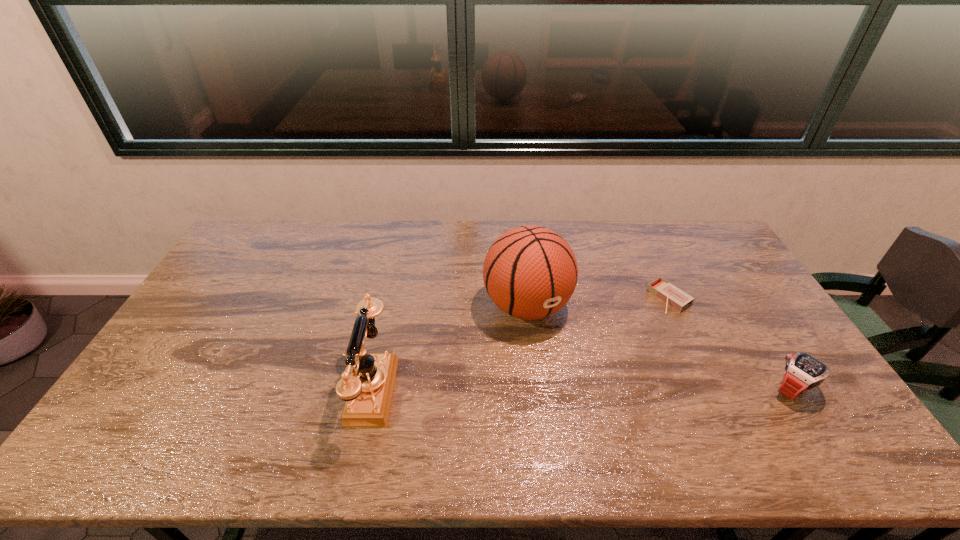
At what (x,y) coordinates should I click in order to perform the action: click on object at the right edge. Please return your answer as a coordinate pair (x, y). The height and width of the screenshot is (540, 960). Looking at the image, I should click on (802, 372).

Identify the location of object that is at the near right corner. The height and width of the screenshot is (540, 960). (802, 372).

I want to click on free space at the far edge of the desktop, so click(x=415, y=253).

In the image, there is a desktop. At what (x,y) coordinates should I click in order to perform the action: click on blank space at the near edge. Please return your answer as a coordinate pair (x, y). This screenshot has width=960, height=540. Looking at the image, I should click on (294, 398).

In the image, there is a desktop. In order to click on blank space at the left edge in this screenshot , I will do `click(223, 271)`.

In the image, there is a desktop. Where is `vacant space at the right edge`? Image resolution: width=960 pixels, height=540 pixels. vacant space at the right edge is located at coordinates (728, 307).

The image size is (960, 540). Find the location of `vacant space at the far right corner`. vacant space at the far right corner is located at coordinates [708, 258].

Image resolution: width=960 pixels, height=540 pixels. I want to click on free space at the near right corner of the desktop, so click(x=780, y=417).

The image size is (960, 540). Find the location of `free space between the shortest object and the telephone`. free space between the shortest object and the telephone is located at coordinates (518, 344).

Where is `empty location between the matchbox and the telephone`? empty location between the matchbox and the telephone is located at coordinates (518, 344).